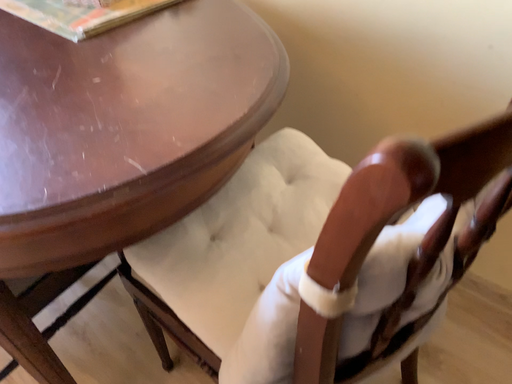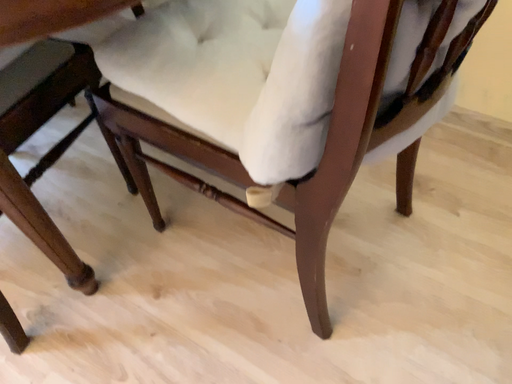
Question: Which way did the camera rotate in the video?

Choices:
 (A) rotated upward
 (B) rotated downward

Answer: (B)